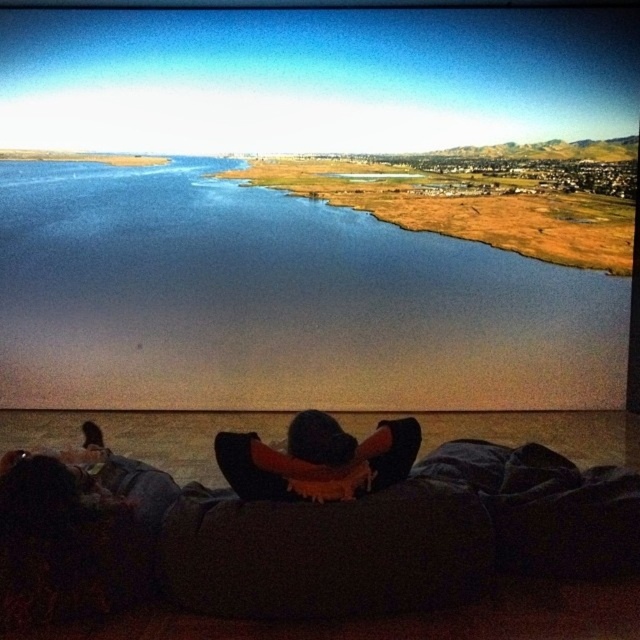
Is blue water at center to the right of black fuzzy hat at center from the viewer's perspective?

In fact, blue water at center is to the left of black fuzzy hat at center.

Can you confirm if blue water at center is shorter than black fuzzy hat at center?

Incorrect, blue water at center's height does not fall short of black fuzzy hat at center's.

What do you see at coordinates (278, 301) in the screenshot? I see `blue water at center` at bounding box center [278, 301].

This screenshot has height=640, width=640. What are the coordinates of `blue water at center` in the screenshot? It's located at (278, 301).